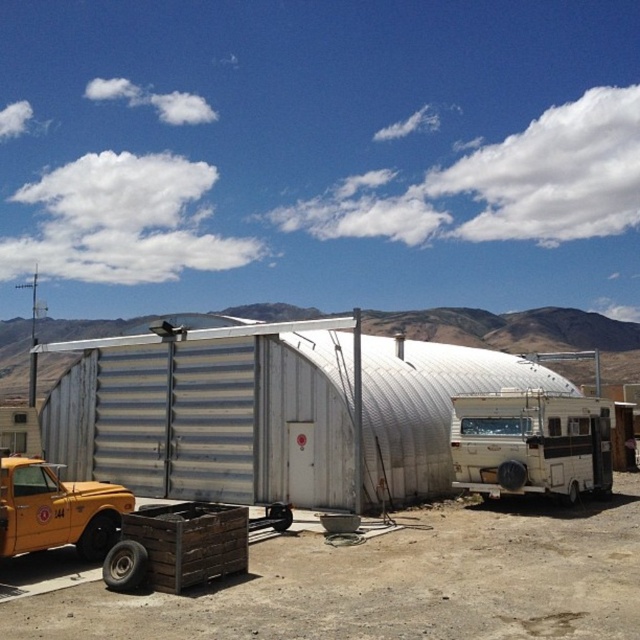
Question: Is silver corrugated metal shed at center wider than white matte trailer truck at right?

Choices:
 (A) no
 (B) yes

Answer: (B)

Question: Which of the following is the farthest from the observer?

Choices:
 (A) yellow matte truck at lower left
 (B) silver corrugated metal shed at center
 (C) white matte trailer truck at right

Answer: (C)

Question: Can you confirm if white matte trailer truck at right is bigger than yellow matte truck at lower left?

Choices:
 (A) yes
 (B) no

Answer: (B)

Question: Can you confirm if silver corrugated metal shed at center is smaller than yellow matte truck at lower left?

Choices:
 (A) no
 (B) yes

Answer: (A)

Question: Which point is closer to the camera?

Choices:
 (A) (221, 412)
 (B) (486, 481)

Answer: (B)

Question: Which point is closer to the camera?

Choices:
 (A) yellow matte truck at lower left
 (B) white matte trailer truck at right
 (C) silver corrugated metal shed at center

Answer: (A)